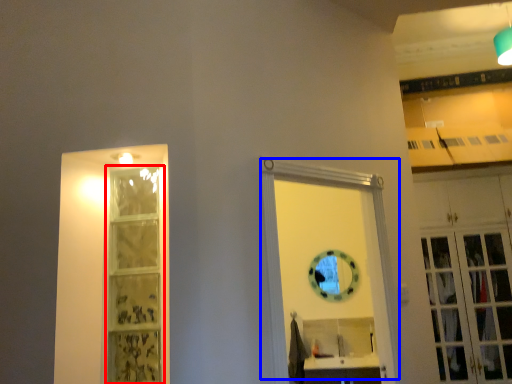
Question: Among these objects, which one is farthest to the camera, shelf (highlighted by a red box) or door (highlighted by a blue box)?

Choices:
 (A) shelf
 (B) door

Answer: (A)